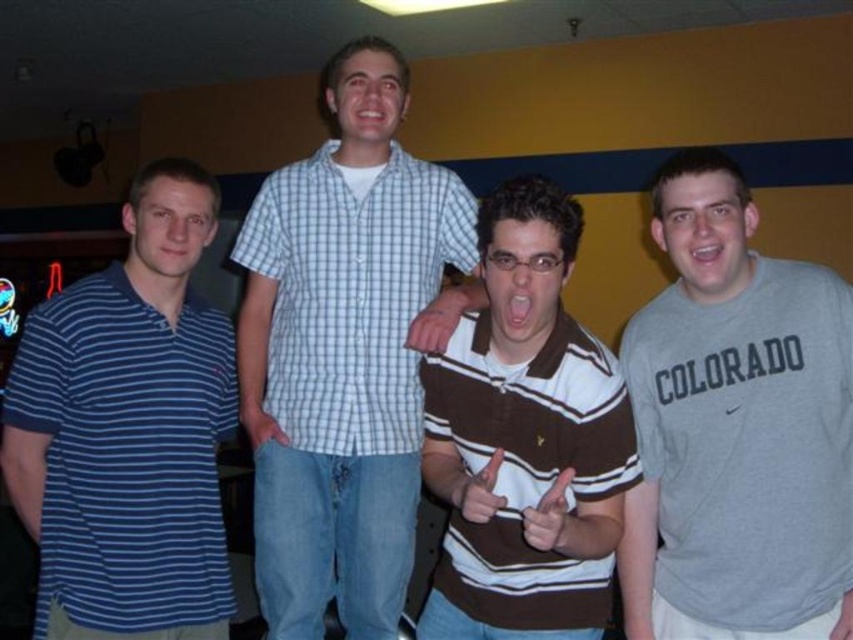
Is point (351, 220) farther from viewer compared to point (520, 484)?

Yes, it is.

Which is behind, point (364, 362) or point (560, 628)?

Positioned behind is point (364, 362).

Who is more distant from viewer, (341, 589) or (532, 188)?

Point (341, 589)

Identify the location of white checkered shirt at center. (345, 352).

Is point (666, 186) closer to camera compared to point (144, 584)?

That is True.

This screenshot has width=853, height=640. Identify the location of gray cotton t-shirt at right. (735, 422).

Does white checkered shirt at center have a greater height compared to blue striped polo shirt at left?

Yes, white checkered shirt at center is taller than blue striped polo shirt at left.

Where is `white checkered shirt at center`? The height and width of the screenshot is (640, 853). white checkered shirt at center is located at coordinates (345, 352).

Where is `white checkered shirt at center`? This screenshot has width=853, height=640. white checkered shirt at center is located at coordinates (345, 352).